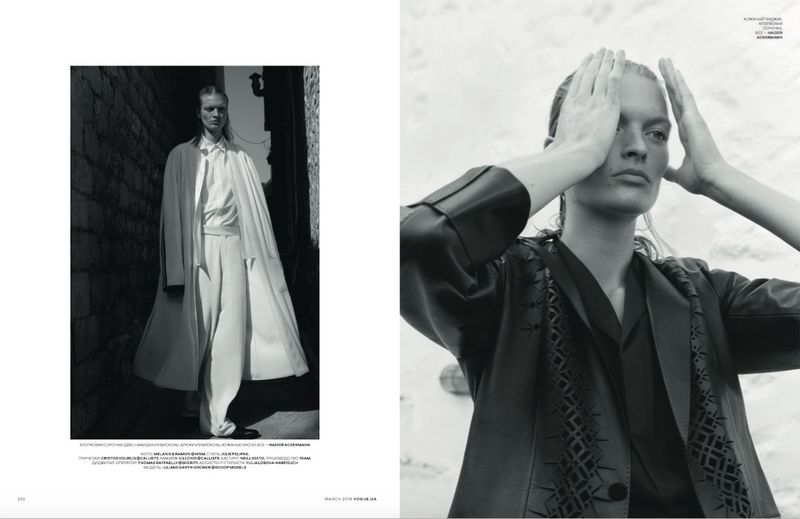
Where is `photographs`? Image resolution: width=800 pixels, height=519 pixels. photographs is located at coordinates (216, 258), (562, 244).